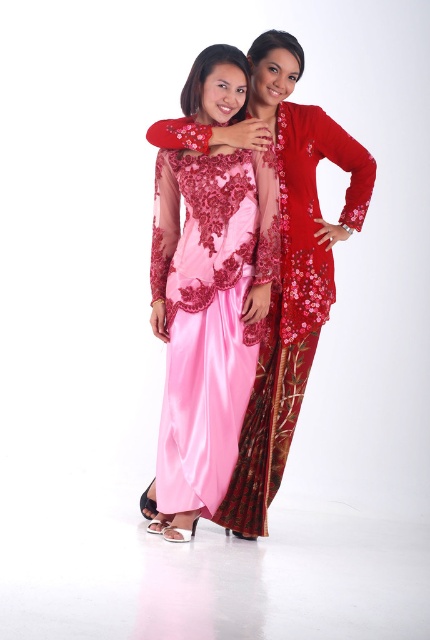
You are a photographer setting up for a photoshoot and need to position a spotlight. The spotlight can only illuminate objects taller than the velvet red robe at center. Will the spotlight illuminate the satin pink dress at center?

The satin pink dress at center is taller than the velvet red robe at center, so yes, the spotlight will illuminate the satin pink dress at center because it meets the height requirement.

Based on the photo, you are a photographer setting up for a photoshoot and need to position a spotlight exactly at the point marked by coordinates point (202,326). According to the scene description, which object will the spotlight illuminate?

The point (202,326) corresponds to the satin pink dress at center, so the spotlight will illuminate the satin pink dress at center.

You are standing at the point marked as point (232, 353) in the image. The two people in the scene are positioned such that they are close to each other. If you want to approach them without entering their personal space, which direction should you move to maintain a safe distance of at least 1.5 meters from both individuals?

Since the point (232, 353) is 2.40 meters away from the viewer, moving directly towards the two individuals would decrease the distance below the required 1.5 meters. To maintain a safe distance of at least 1.5 meters from both, you should move away from the direction of the individuals, increasing the distance beyond 2.40 meters. Alternatively, moving sideways perpendicular to the line connecting the point and the individuals can also help maintain the distance if done carefully.